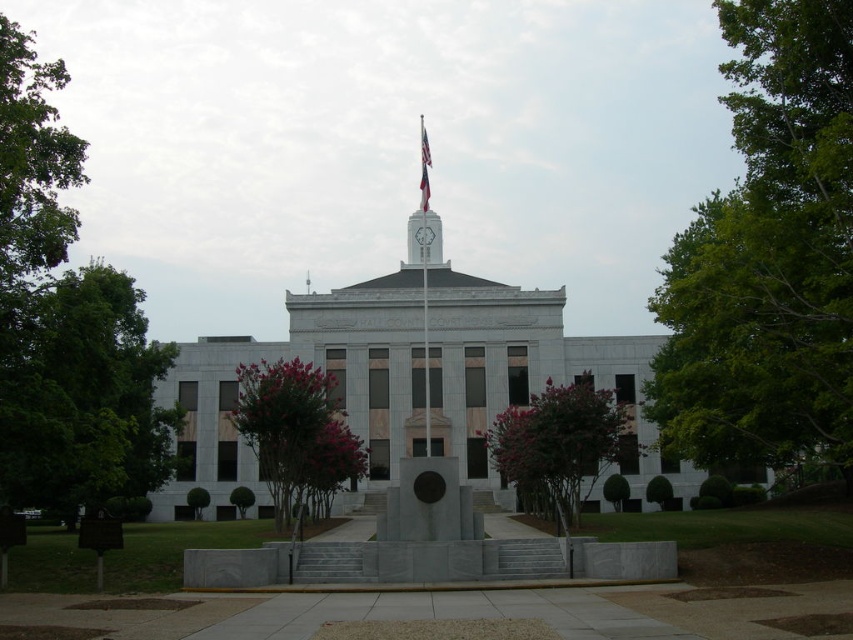
You are a photographer planning to capture the building and its surroundings. You notice the purple leafy tree at center and the white fabric flag at center in your frame. Which object appears wider in the photo?

The purple leafy tree at center appears wider than the white fabric flag at center because its width surpasses the flag.

You are a photographer planning to take a symmetrical composition photo of the building and its surroundings. You notice the purple leafy tree at center and the white fabric flag at center. Which object should you adjust to maintain symmetry if you want both to be in the frame?

Since the purple leafy tree at center is larger than the white fabric flag at center, you should adjust the position of the white fabric flag at center to ensure both are balanced in the frame.